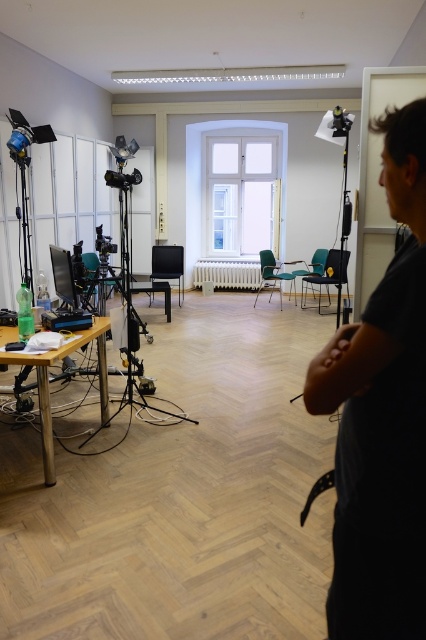
What do you see at coordinates (382, 417) in the screenshot?
I see `black matte shirt at right` at bounding box center [382, 417].

Describe the element at coordinates (382, 417) in the screenshot. I see `black matte shirt at right` at that location.

Identify the location of black matte shirt at right. The image size is (426, 640). (382, 417).